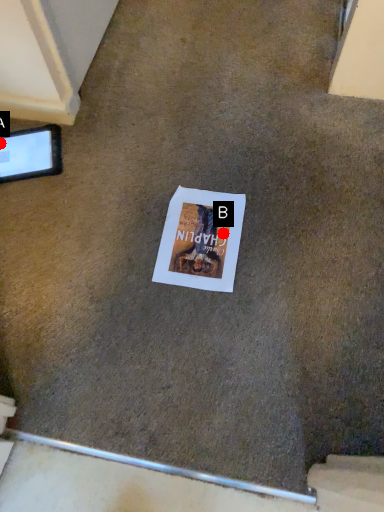
Question: Two points are circled on the image, labeled by A and B beside each circle. Which point is closer to the camera?

Choices:
 (A) A is closer
 (B) B is closer

Answer: (B)